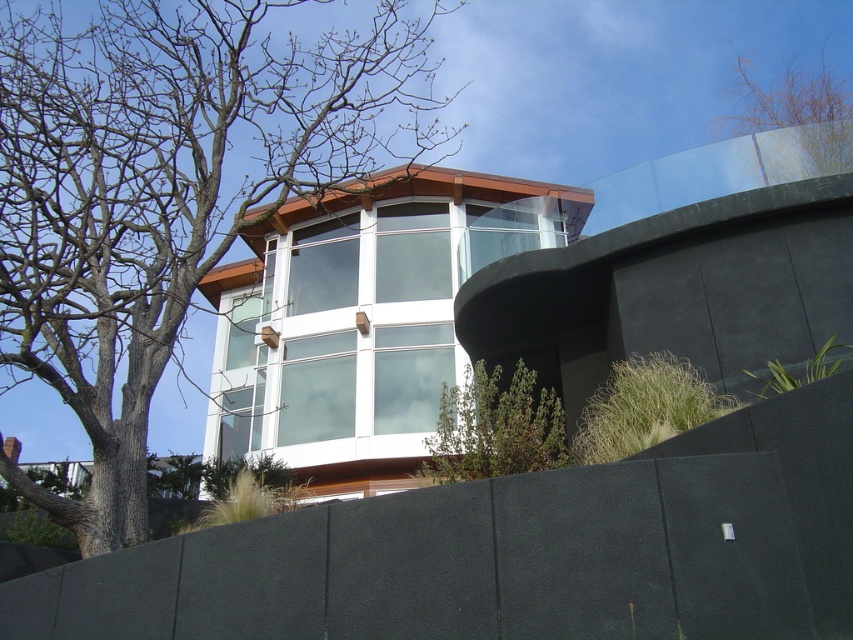
In the scene shown: Who is positioned more to the right, brown leafless tree at left or bare branches at upper right?

bare branches at upper right is more to the right.

Does brown leafless tree at left have a larger size compared to bare branches at upper right?

Yes, brown leafless tree at left is bigger than bare branches at upper right.

Does point (103, 392) come behind point (747, 100)?

No, it is not.

Where is `brown leafless tree at left`? Image resolution: width=853 pixels, height=640 pixels. brown leafless tree at left is located at coordinates (167, 192).

Does point (555, 204) come in front of point (474, 432)?

No, it is behind (474, 432).

What do you see at coordinates (361, 320) in the screenshot? Image resolution: width=853 pixels, height=640 pixels. I see `clear glass windows at center` at bounding box center [361, 320].

Does point (380, 321) come in front of point (514, 404)?

No, it is behind (514, 404).

I want to click on clear glass windows at center, so click(361, 320).

Can you confirm if brown leafless tree at left is wider than clear glass windows at center?

Correct, the width of brown leafless tree at left exceeds that of clear glass windows at center.

Consider the image. Is brown leafless tree at left shorter than clear glass windows at center?

No, brown leafless tree at left is not shorter than clear glass windows at center.

Who is more forward, (93, 42) or (224, 340)?

Point (224, 340) is in front.

Image resolution: width=853 pixels, height=640 pixels. In order to click on brown leafless tree at left in this screenshot , I will do `click(167, 192)`.